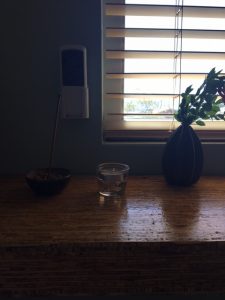
This screenshot has height=300, width=225. Identify the location of black bowl. (48, 186).